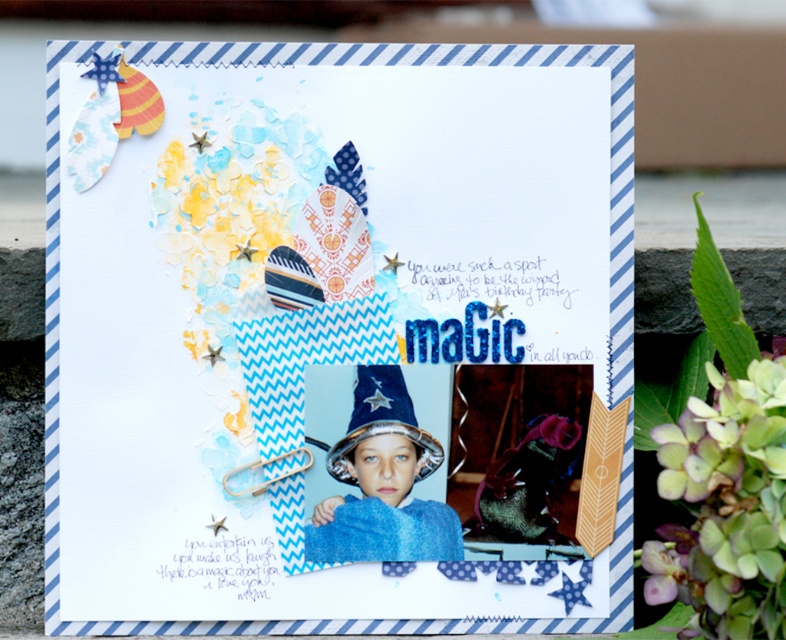
Is point (299, 381) closer to viewer compared to point (692, 529)?

No, (299, 381) is behind (692, 529).

Is matte blue wizard hat at center positioned behind green matte hydrangea at upper right?

Yes, matte blue wizard hat at center is further from the viewer.

Identify the location of matte blue wizard hat at center. Image resolution: width=786 pixels, height=640 pixels. click(x=318, y=321).

Who is more forward, (467, 337) or (395, 381)?

Positioned in front is point (395, 381).

Between point (167, 88) and point (439, 420), which one is positioned behind?

The point (439, 420) is more distant.

Who is more distant from viewer, (x=513, y=353) or (x=384, y=458)?

Positioned behind is point (x=513, y=353).

In order to click on matte blue wizard hat at center in this screenshot , I will do `click(318, 321)`.

Does blue felt wizard hat at center appear on the right side of shiny silver wizard hat at center?

In fact, blue felt wizard hat at center is to the left of shiny silver wizard hat at center.

Can you confirm if blue felt wizard hat at center is wider than shiny silver wizard hat at center?

Correct, the width of blue felt wizard hat at center exceeds that of shiny silver wizard hat at center.

Which is in front, point (333, 513) or point (351, 420)?

Point (333, 513) is in front.

The image size is (786, 640). Find the location of `blue felt wizard hat at center`. blue felt wizard hat at center is located at coordinates (377, 465).